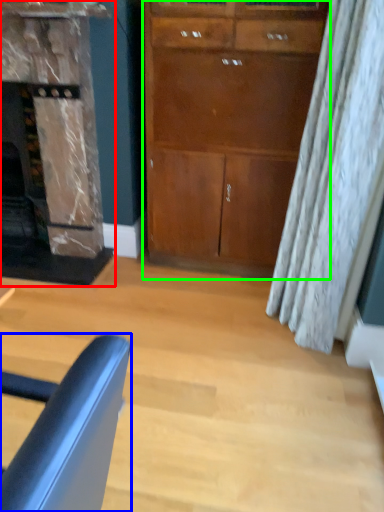
Question: Which object is the closest to the fireplace (highlighted by a red box)? Choose among these: chair (highlighted by a blue box) or cabinetry (highlighted by a green box).

Choices:
 (A) chair
 (B) cabinetry

Answer: (B)